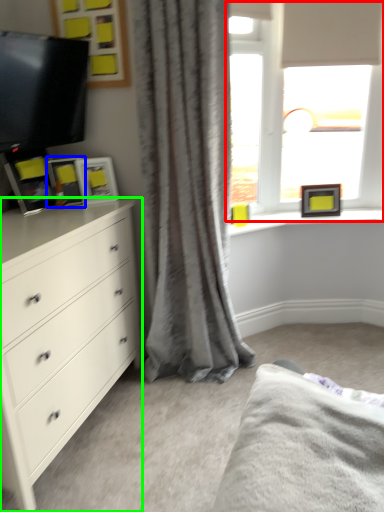
Question: Estimate the real-world distances between objects in this image. Which object is closer to window (highlighted by a red box), picture frame (highlighted by a blue box) or chest of drawers (highlighted by a green box)?

Choices:
 (A) picture frame
 (B) chest of drawers

Answer: (A)